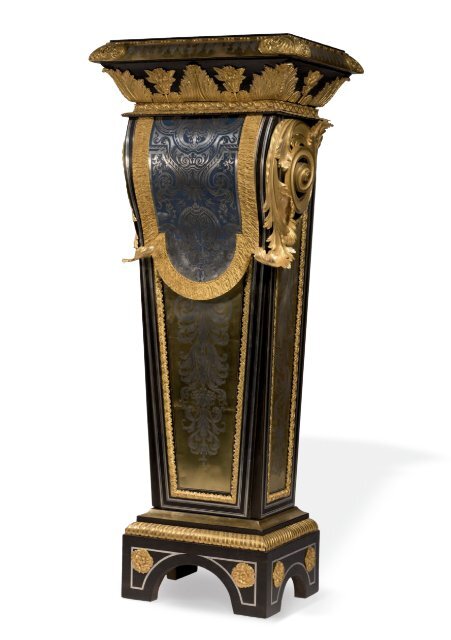
At what (x,y) coordinates should I click in order to perform the action: click on gold circles on front base of artwork. Please return your answer as a coordinate pair (x, y). Looking at the image, I should click on (246, 570), (143, 561).